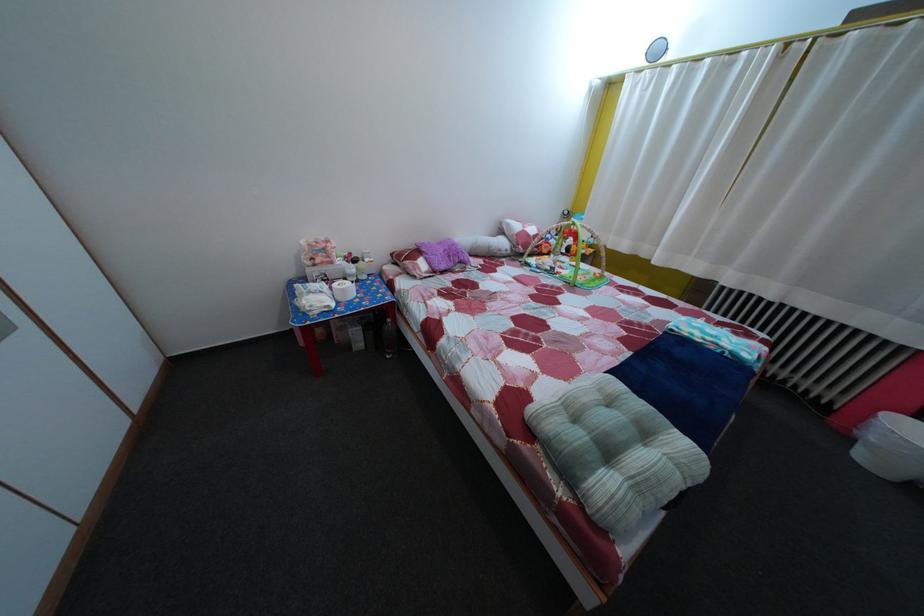
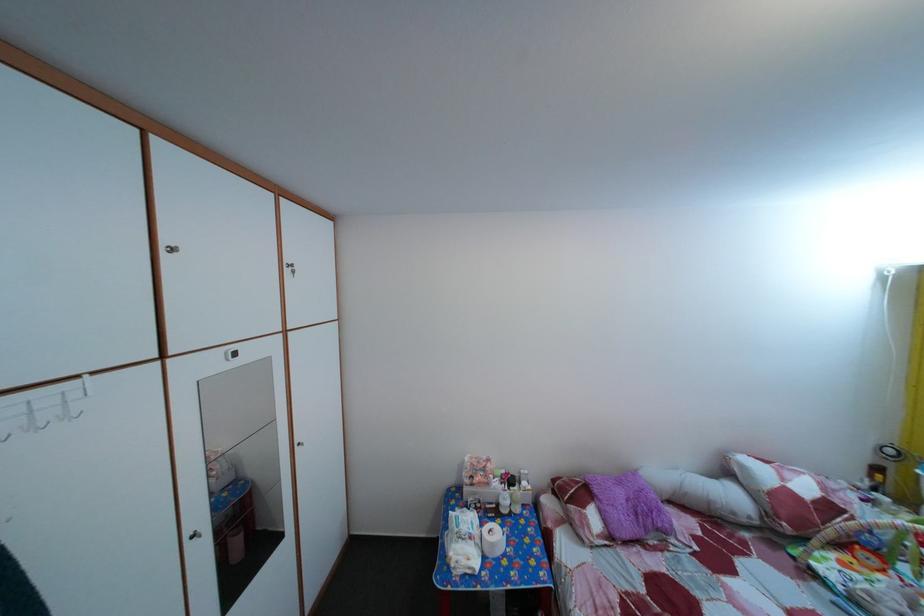
Where in the second image is the point corresponding to pixel 353 299 from the first image?

(502, 553)